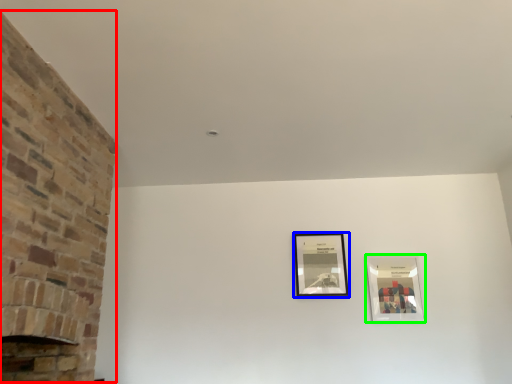
Question: Which object is the closest to the fireplace (highlighted by a red box)? Choose among these: picture frame (highlighted by a blue box) or picture frame (highlighted by a green box).

Choices:
 (A) picture frame
 (B) picture frame

Answer: (A)